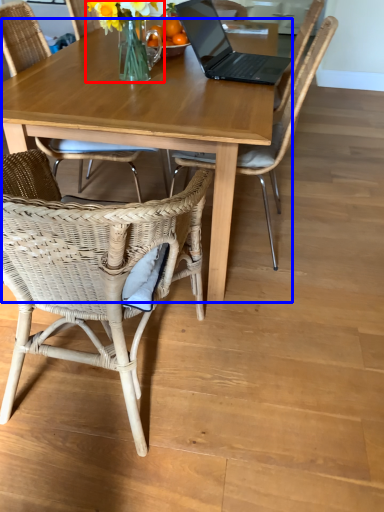
Question: Which point is closer to the camera, floral arrangement (highlighted by a red box) or coffee table (highlighted by a blue box)?

Choices:
 (A) floral arrangement
 (B) coffee table

Answer: (B)